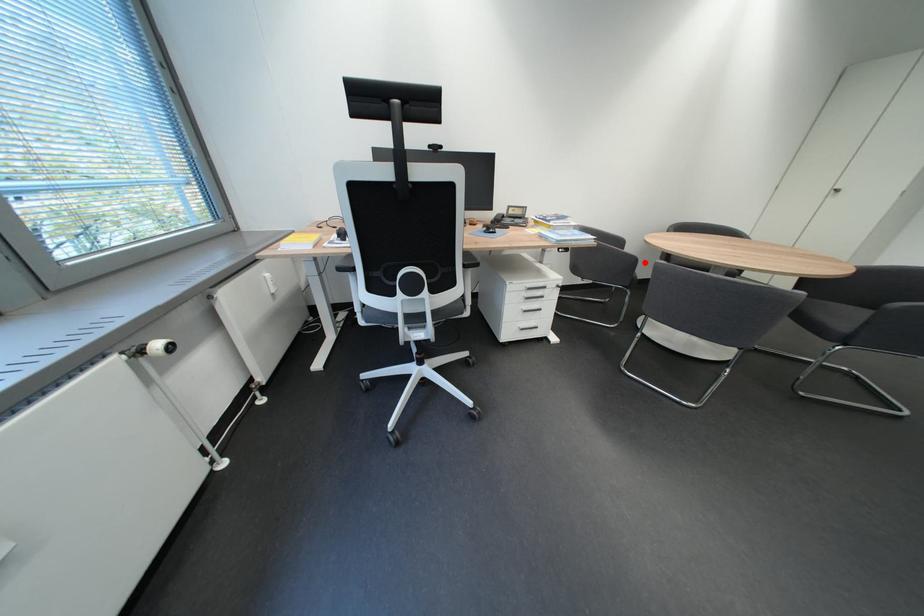
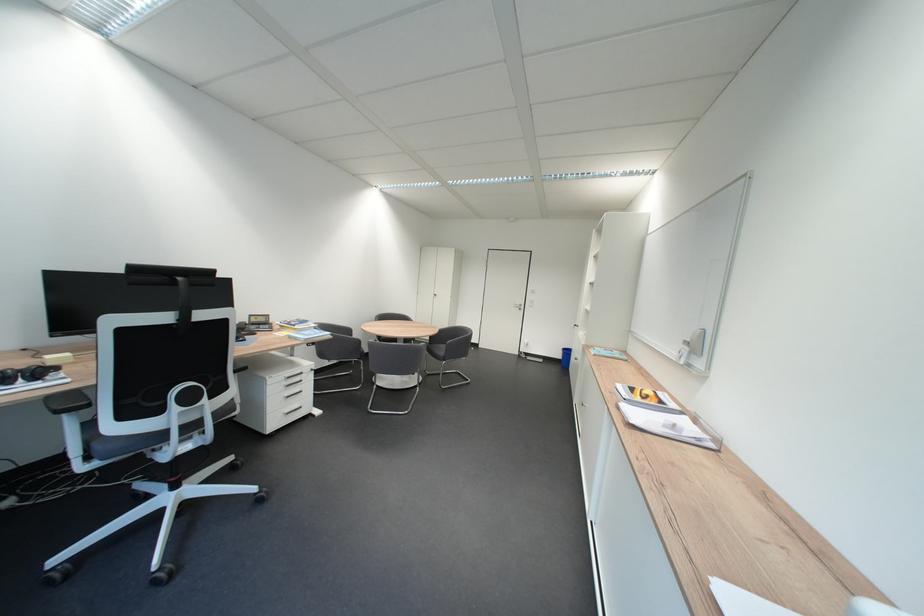
Question: I am providing you with two images of the same scene from different viewpoints. In image1, a red point is highlighted. Considering the same 3D point in image2, which of the following is correct?

Choices:
 (A) It is closer
 (B) It is farther

Answer: (B)